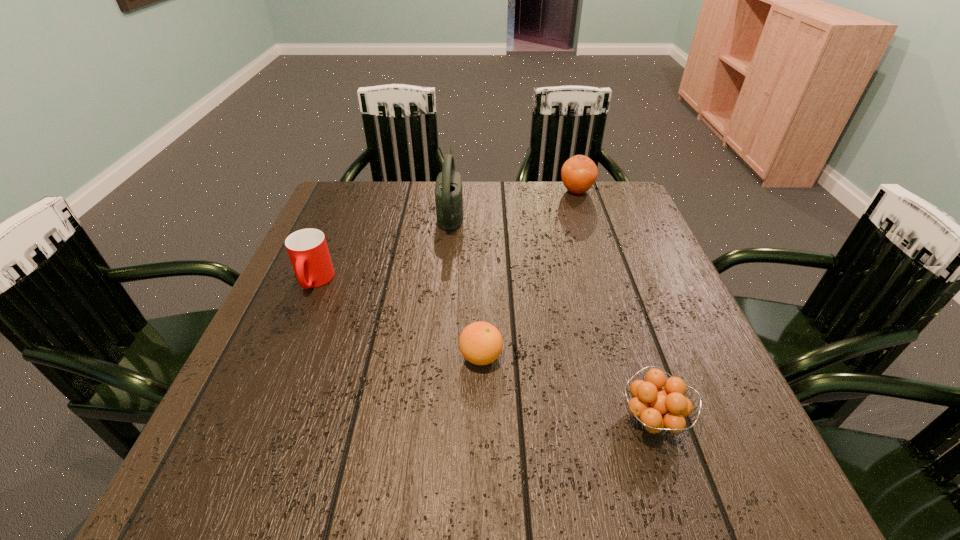
I want to click on empty space that is in between the nearest orange and the watering can, so click(x=552, y=315).

Where is `vacant area that lies between the watering can and the second farthest orange`? vacant area that lies between the watering can and the second farthest orange is located at coordinates (466, 284).

Identify the location of empty space that is in between the leftmost orange and the nearest orange. (566, 388).

Find the location of a particular element. Image resolution: width=960 pixels, height=540 pixels. object identified as the second closest to the leftmost orange is located at coordinates (307, 248).

The height and width of the screenshot is (540, 960). Identify the location of object that is the closest to the third nearest object. (448, 188).

Identify which orange is the closest to the tallest orange. Please provide its 2D coordinates. Your answer should be formatted as a tuple, i.e. [(x, y)], where the tuple contains the x and y coordinates of a point satisfying the conditions above.

[(480, 343)]

At what (x,y) coordinates should I click in order to perform the action: click on orange object that ranks as the closest to the second nearest object. Please return your answer as a coordinate pair (x, y). Looking at the image, I should click on (657, 408).

At what (x,y) coordinates should I click in order to perform the action: click on free space that satisfies the following two spatial constraints: 1. on the spout of the watering can; 2. on the left side of the nearest object. Please return your answer as a coordinate pair (x, y). The width and height of the screenshot is (960, 540). Looking at the image, I should click on pyautogui.click(x=432, y=420).

You are a GUI agent. You are given a task and a screenshot of the screen. Output one action in this format:
    pyautogui.click(x=<x>, y=<y>)
    Task: Click on the free space that satisfies the following two spatial constraints: 1. on the side of the second nearest orange with the handle; 2. on the left side of the third nearest object
    This screenshot has height=540, width=960.
    Given the screenshot: What is the action you would take?
    pyautogui.click(x=282, y=357)

I want to click on blank space that satisfies the following two spatial constraints: 1. on the spout of the fourth object from right to left; 2. on the back side of the nearest orange, so click(432, 420).